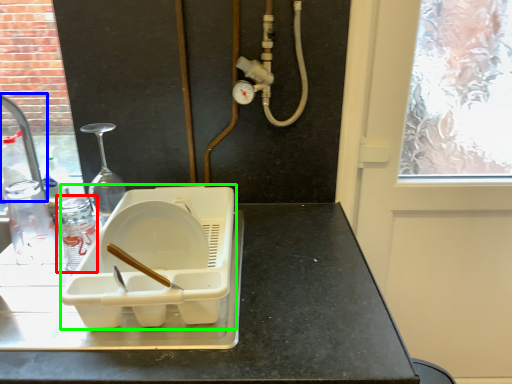
Question: Based on their relative distances, which object is nearer to bottle (highlighted by a red box)? Choose from faucet (highlighted by a blue box) and appliance (highlighted by a green box).

Choices:
 (A) faucet
 (B) appliance

Answer: (B)